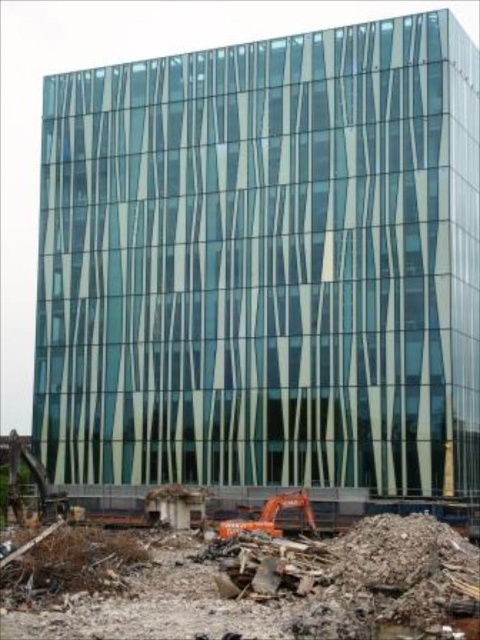
Question: Is the position of rubble concrete at lower center less distant than that of orange metallic excavator at lower center?

Choices:
 (A) no
 (B) yes

Answer: (B)

Question: In this image, where is rubble concrete at lower center located relative to orange metallic excavator at lower center?

Choices:
 (A) below
 (B) above

Answer: (B)

Question: Can you confirm if rubble concrete at lower center is bigger than orange metallic excavator at lower center?

Choices:
 (A) yes
 (B) no

Answer: (A)

Question: Among these points, which one is nearest to the camera?

Choices:
 (A) click(x=385, y=538)
 (B) click(x=296, y=492)

Answer: (A)

Question: Which object appears closest to the camera in this image?

Choices:
 (A) rubble concrete at lower center
 (B) orange metallic excavator at lower center

Answer: (A)